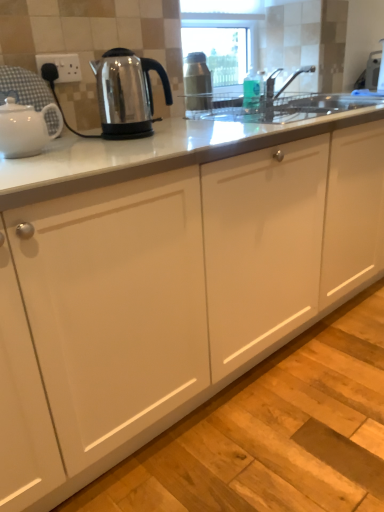
Where is `free space in front of stainless steel kettle at left, the second kettle viewed from the left`? free space in front of stainless steel kettle at left, the second kettle viewed from the left is located at coordinates click(135, 144).